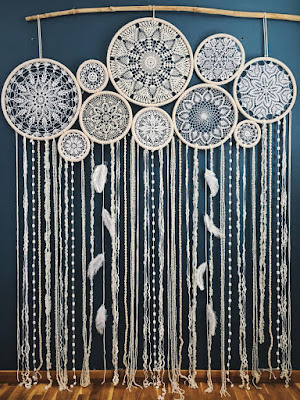
Image resolution: width=300 pixels, height=400 pixels. Identify the location of dream catchers. pos(39,94), pos(68,149), pos(117,113), pos(99,73), pos(150,50), pos(157,123), pos(208,120), pos(225,52), pos(272,101), pos(247,136).